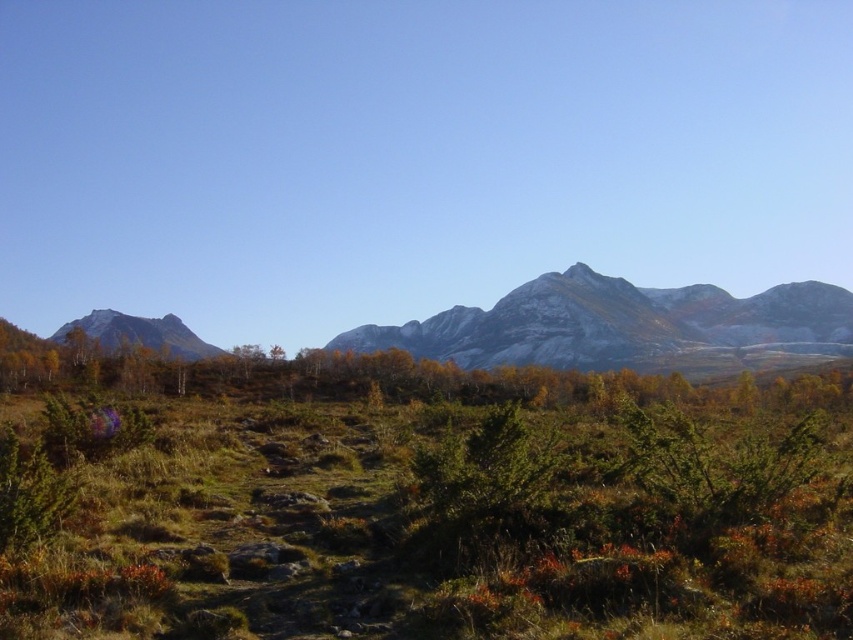
Is rocky gray mountain range at center taller than green leafy shrub at center?

Indeed, rocky gray mountain range at center has a greater height compared to green leafy shrub at center.

Is rocky gray mountain range at center below green leafy shrub at center?

Actually, rocky gray mountain range at center is above green leafy shrub at center.

In order to click on rocky gray mountain range at center in this screenshot , I will do `click(627, 326)`.

Is rocky gray mountain range at center taller than smooth gray rock at left?

Indeed, rocky gray mountain range at center has a greater height compared to smooth gray rock at left.

In the scene shown: Who is more forward, (769, 289) or (167, 344)?

Point (167, 344) is in front.

What do you see at coordinates (627, 326) in the screenshot?
I see `rocky gray mountain range at center` at bounding box center [627, 326].

Locate an element on the screen. rocky gray mountain range at center is located at coordinates (627, 326).

Is point (457, 396) closer to camera compared to point (170, 317)?

Yes, it is.

Is point (4, 376) behind point (207, 349)?

That is False.

Describe the element at coordinates (294, 372) in the screenshot. I see `green leafy shrub at center` at that location.

The height and width of the screenshot is (640, 853). Identify the location of green leafy shrub at center. (294, 372).